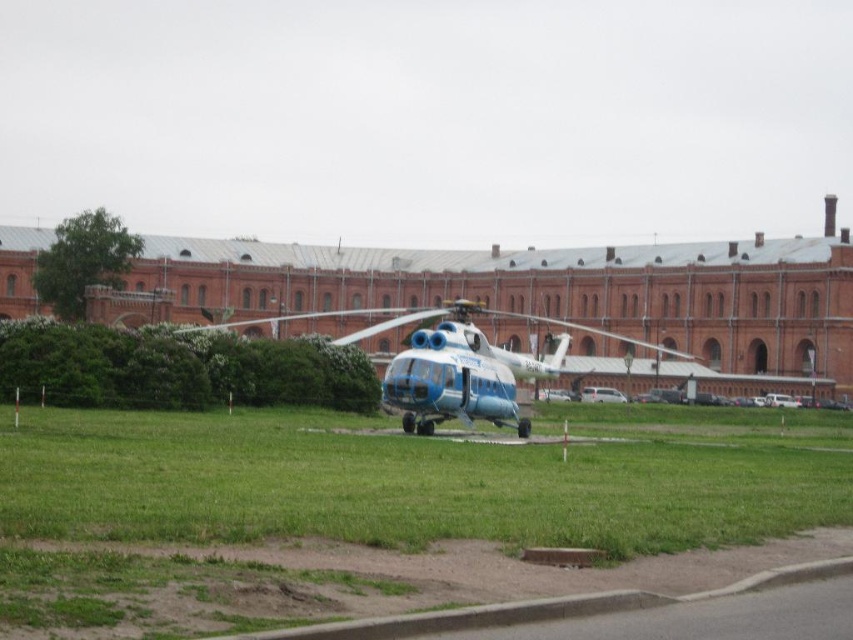
Question: Does green grass at center appear on the left side of blue metallic helicopter at center?

Choices:
 (A) yes
 (B) no

Answer: (B)

Question: Can you confirm if green grass at center is positioned to the left of blue metallic helicopter at center?

Choices:
 (A) yes
 (B) no

Answer: (B)

Question: Which point is farther from the camera taking this photo?

Choices:
 (A) (524, 426)
 (B) (741, 444)

Answer: (B)

Question: Which of the following is the farthest from the observer?

Choices:
 (A) blue metallic helicopter at center
 (B) green grass at center

Answer: (A)

Question: Does green grass at center appear over blue metallic helicopter at center?

Choices:
 (A) no
 (B) yes

Answer: (A)

Question: Which point is closer to the camera?

Choices:
 (A) (454, 378)
 (B) (277, 531)

Answer: (B)